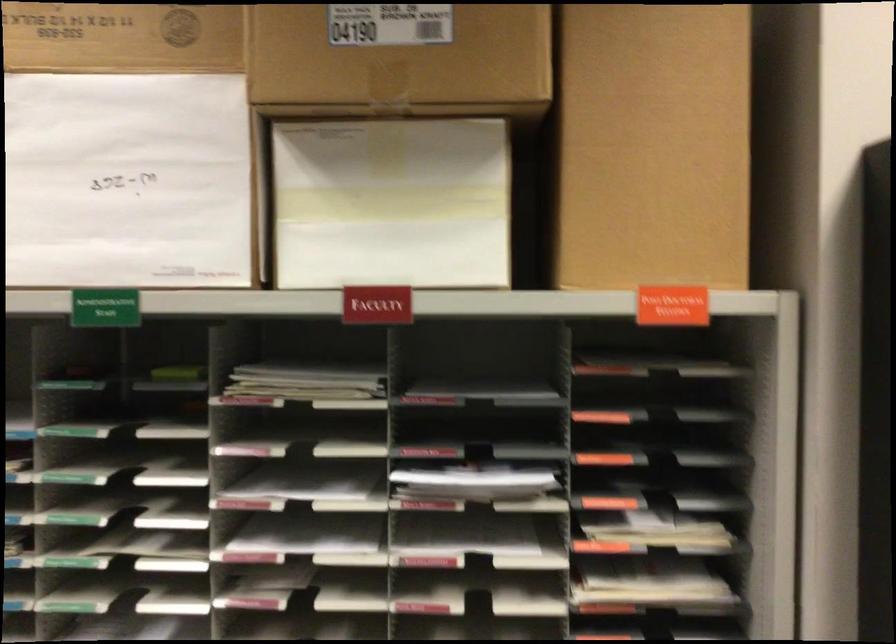
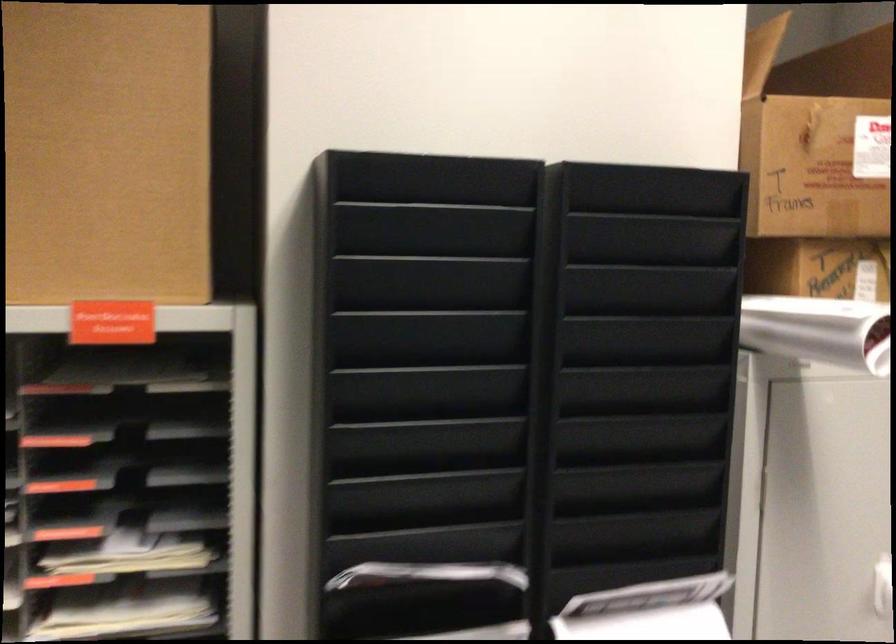
Question: Which direction would the cameraman need to move to produce the second image? Reply with the corresponding letter.

Choices:
 (A) Left
 (B) Right
 (C) Forward
 (D) Backward

Answer: (B)